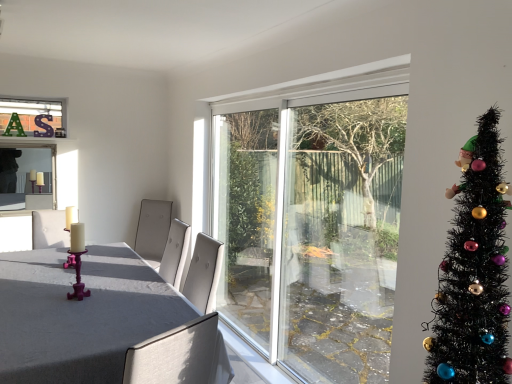
Question: From the image's perspective, is black artificial christmas tree at right positioned above or below matte glass candlesticks at left?

Choices:
 (A) below
 (B) above

Answer: (A)

Question: From a real-world perspective, is black artificial christmas tree at right above or below matte glass candlesticks at left?

Choices:
 (A) above
 (B) below

Answer: (A)

Question: Considering the real-world distances, which object is closest to the matte gray table at center?

Choices:
 (A) purple metallic candle holder at left
 (B) black artificial christmas tree at right
 (C) white glossy candle at left
 (D) matte glass candlesticks at left

Answer: (A)

Question: Considering the real-world distances, which object is farthest from the white glossy candle at left?

Choices:
 (A) purple metallic candle holder at left
 (B) black artificial christmas tree at right
 (C) matte gray table at center
 (D) matte glass candlesticks at left

Answer: (B)